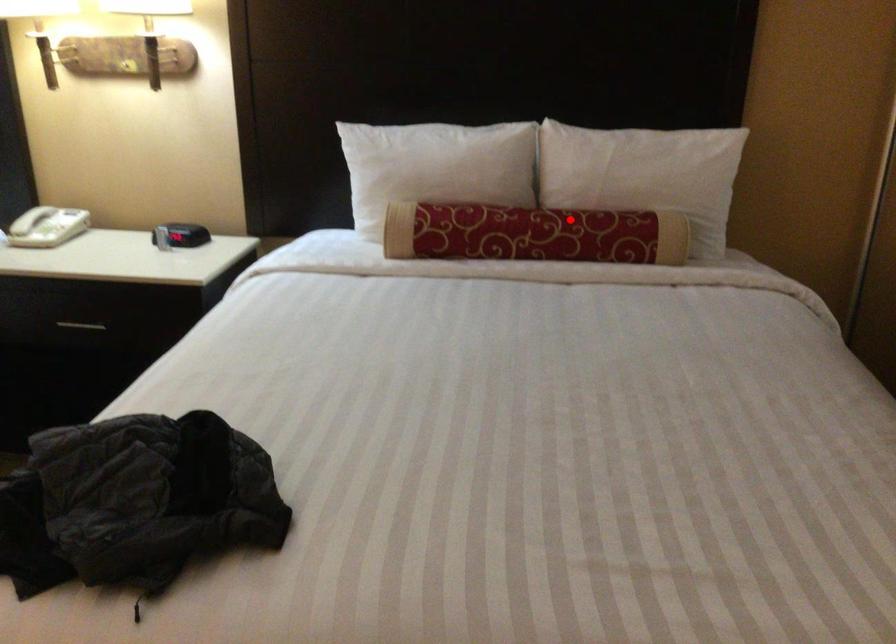
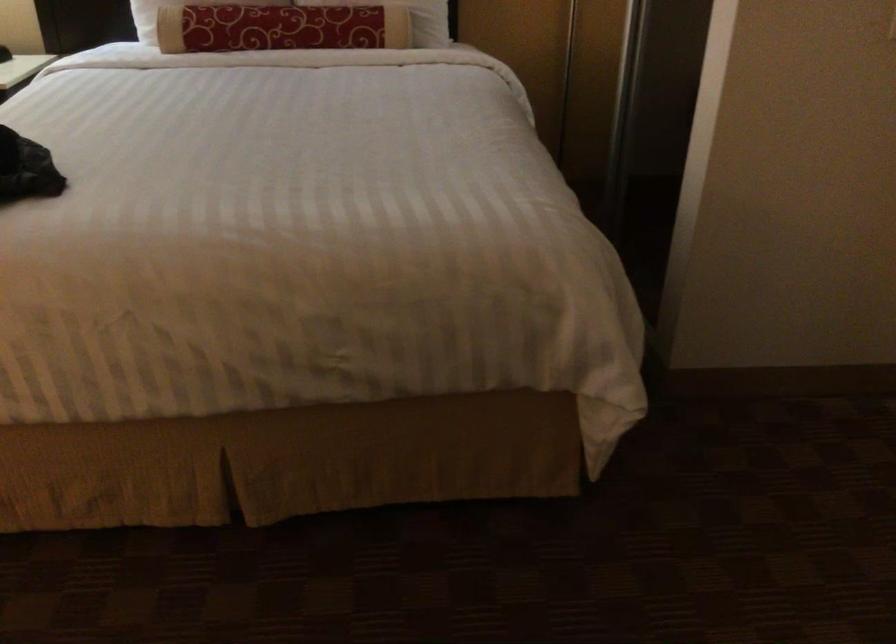
Question: I am providing you with two images of the same scene from different viewpoints. A red point is shown in image1. For the corresponding object point in image2, is it positioned nearer or farther from the camera?

Choices:
 (A) Nearer
 (B) Farther

Answer: (B)